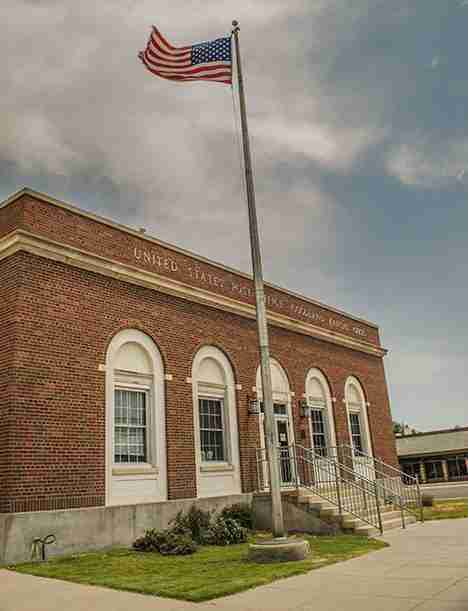
I want to click on stairs, so click(369, 530), click(351, 525), click(338, 518), click(329, 511), click(318, 506), click(307, 498), click(299, 489).